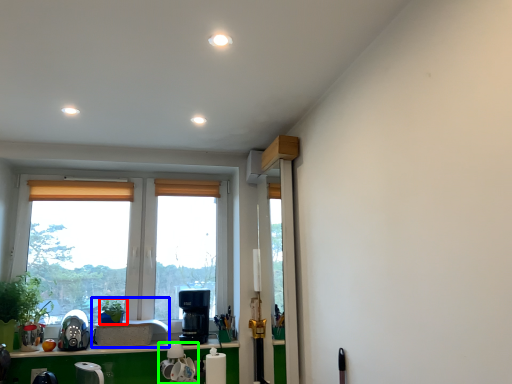
Question: Which is farther away from plant (highlighted by a red box)? sink (highlighted by a blue box) or appliance (highlighted by a green box)?

Choices:
 (A) sink
 (B) appliance

Answer: (B)